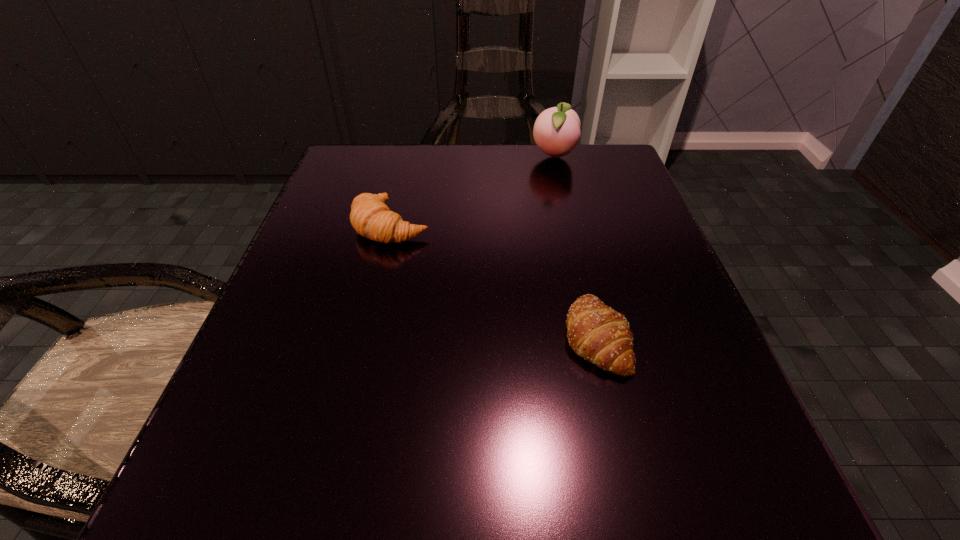
Image resolution: width=960 pixels, height=540 pixels. I want to click on object located at the left edge, so click(370, 216).

Identify the location of peach situated at the right edge. This screenshot has width=960, height=540. (556, 131).

Where is `crescent roll that is at the right edge`? crescent roll that is at the right edge is located at coordinates (596, 332).

Find the location of a particular element. object that is positioned at the far right corner is located at coordinates (556, 131).

Identify the location of vacant space at the far edge. This screenshot has width=960, height=540. (444, 154).

Image resolution: width=960 pixels, height=540 pixels. In the image, there is a desktop. Identify the location of vacant space at the near edge. (623, 509).

You are a GUI agent. You are given a task and a screenshot of the screen. Output one action in this format:
    pyautogui.click(x=<x>, y=<y>)
    Task: Click on the vacant region at the left edge of the desktop
    This screenshot has height=540, width=960.
    Given the screenshot: What is the action you would take?
    pyautogui.click(x=342, y=238)

The width and height of the screenshot is (960, 540). What are the coordinates of `blank space at the right edge of the desktop` in the screenshot? It's located at (639, 267).

The height and width of the screenshot is (540, 960). Identify the location of vacant space at the far left corner. (387, 173).

Image resolution: width=960 pixels, height=540 pixels. What are the coordinates of `vacant space at the far right corner of the desktop` in the screenshot? It's located at tap(608, 150).